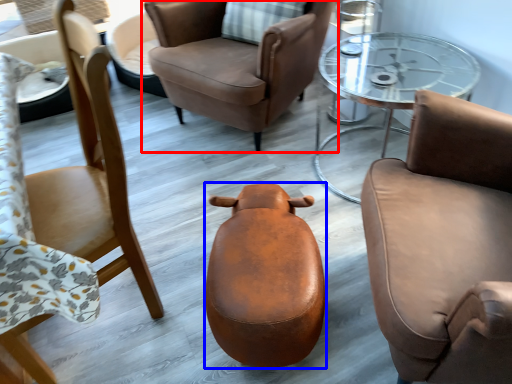
Question: Which object is further to the camera taking this photo, chair (highlighted by a red box) or stool (highlighted by a blue box)?

Choices:
 (A) chair
 (B) stool

Answer: (A)